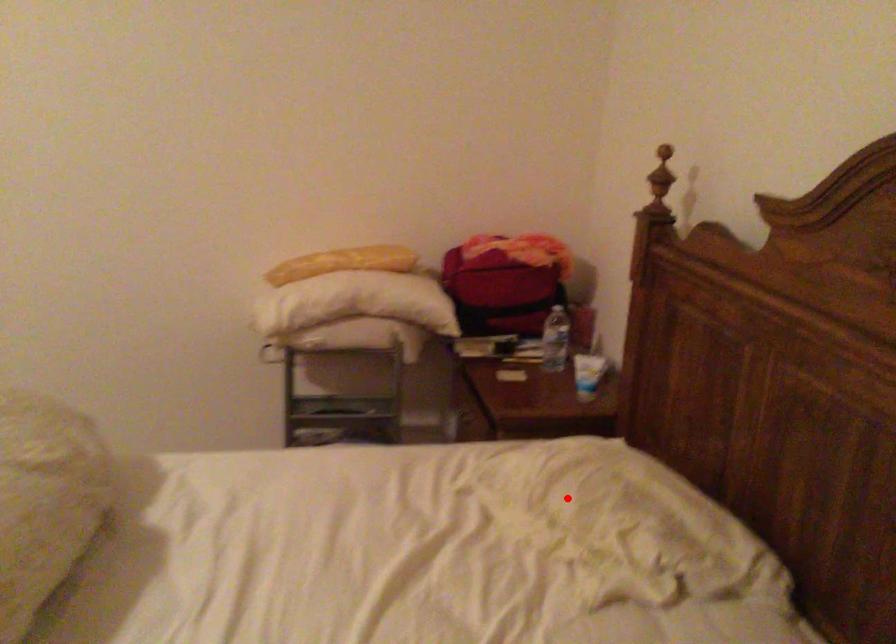
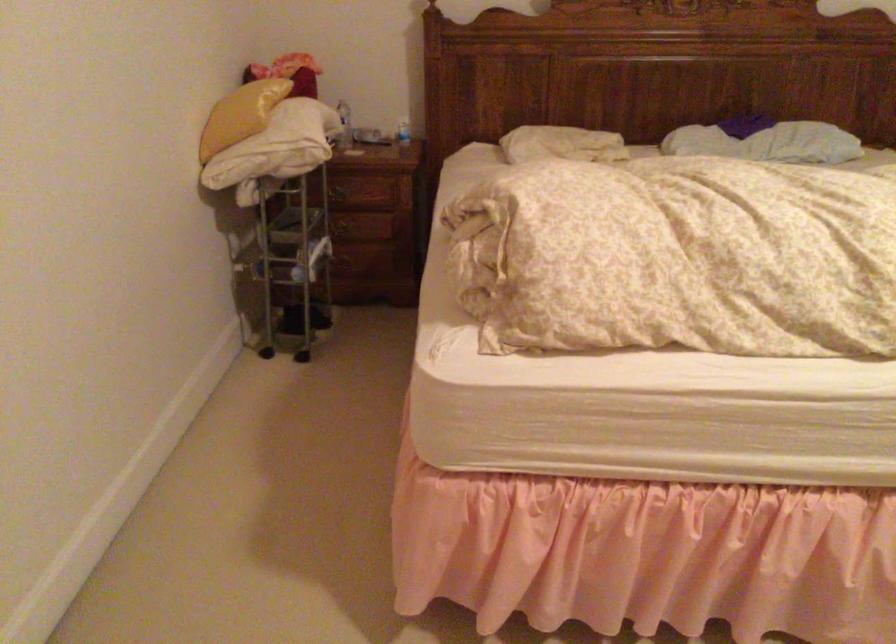
Question: I am providing you with two images of the same scene from different viewpoints. A red point is shown in image1. For the corresponding object point in image2, is it positioned nearer or farther from the camera?

Choices:
 (A) Nearer
 (B) Farther

Answer: (B)